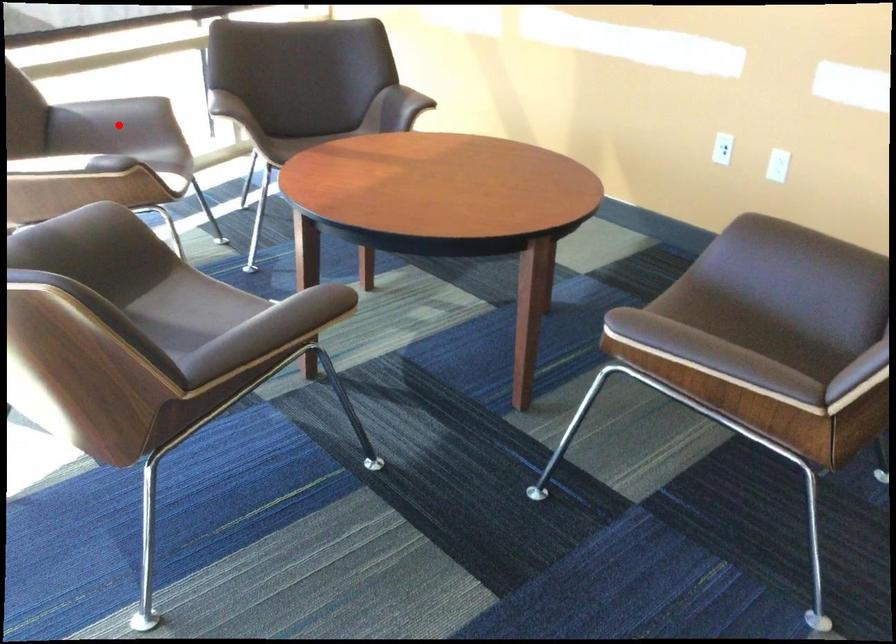
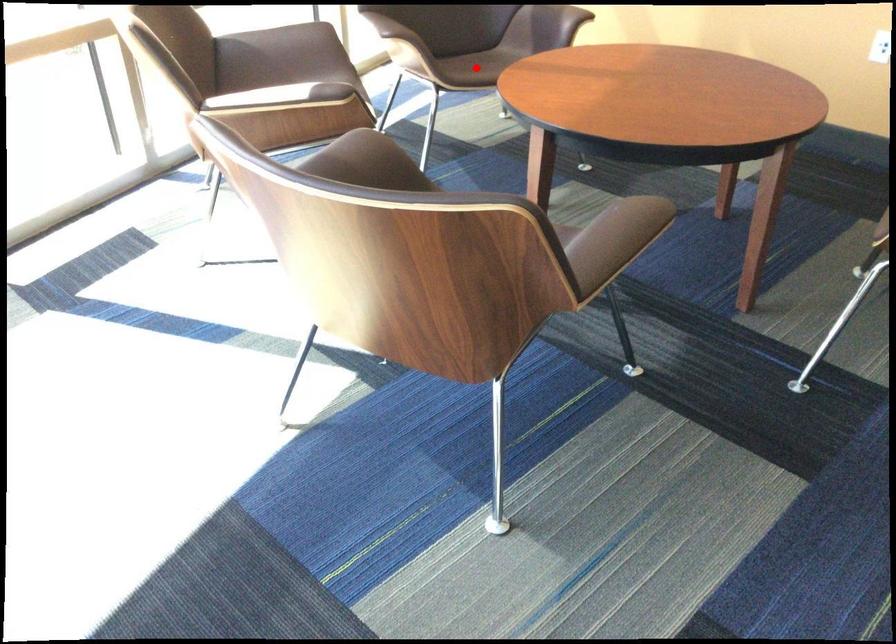
I am providing you with two images of the same scene from different viewpoints. A red point is marked on the first image and another point is marked on the second image. Is the red point in image1 aligned with the point shown in image2?

No